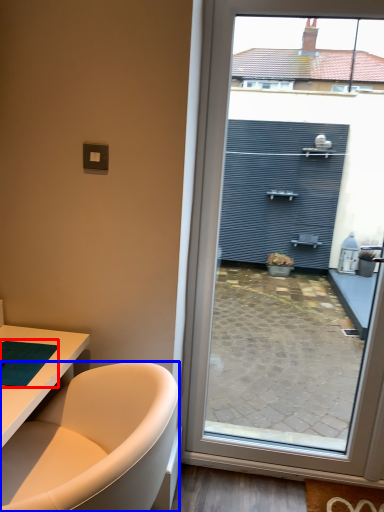
Question: Which object is closer to the camera taking this photo, yoga mat (highlighted by a red box) or bathtub (highlighted by a blue box)?

Choices:
 (A) yoga mat
 (B) bathtub

Answer: (B)